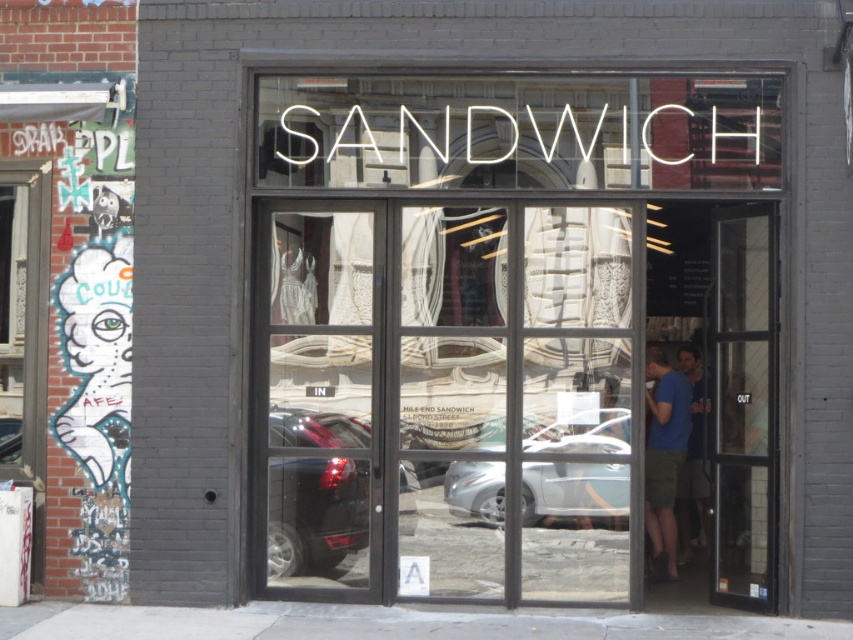
Which is more to the left, white graffiti art at left or black matte car at center?

From the viewer's perspective, white graffiti art at left appears more on the left side.

Can you confirm if white graffiti art at left is thinner than black matte car at center?

Indeed, white graffiti art at left has a lesser width compared to black matte car at center.

Who is more forward, (90, 180) or (367, 492)?

Point (90, 180) is in front.

Find the location of a particular element. white graffiti art at left is located at coordinates (68, 284).

Is point (120, 321) farther from camera compared to point (712, 374)?

No, (120, 321) is in front of (712, 374).

Which is more to the right, white graffiti art at left or transparent glass door at right?

Positioned to the right is transparent glass door at right.

Is point (111, 374) positioned after point (724, 339)?

No, (111, 374) is closer to viewer.

Locate an element on the screen. white graffiti art at left is located at coordinates (68, 284).

Measure the distance between transparent glass door at right and camera.

9.40 meters

Who is taller, transparent glass door at right or black matte car at center?

transparent glass door at right is taller.

At what (x,y) coordinates should I click in order to perform the action: click on transparent glass door at right. Please return your answer as a coordinate pair (x, y). Looking at the image, I should click on (741, 404).